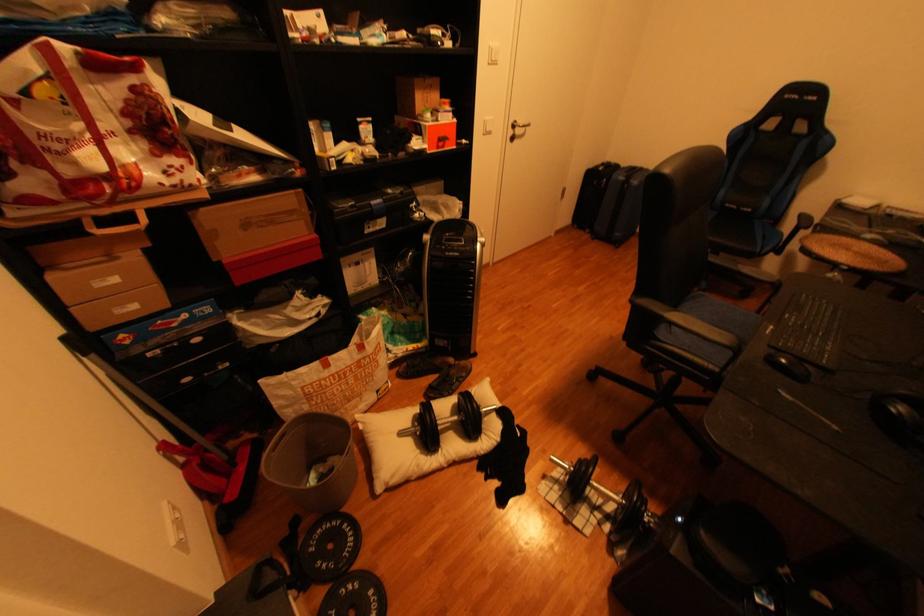
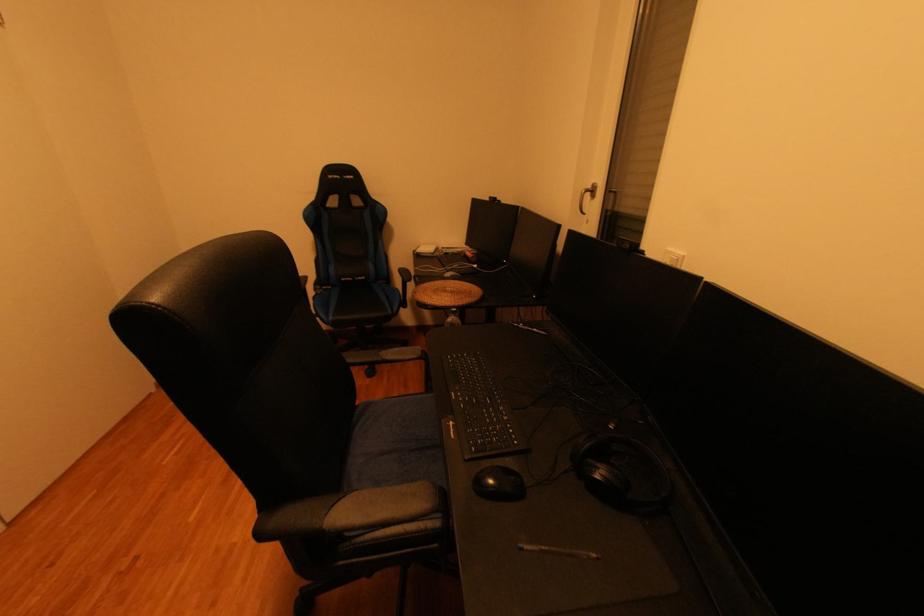
Question: The first image is from the beginning of the video and the second image is from the end. How did the camera likely rotate when shooting the video?

Choices:
 (A) Left
 (B) Right
 (C) Up
 (D) Down

Answer: (B)